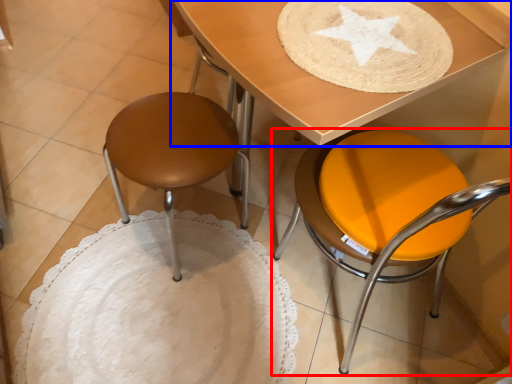
Question: Which point is closer to the camera, chair (highlighted by a red box) or table (highlighted by a blue box)?

Choices:
 (A) chair
 (B) table

Answer: (A)